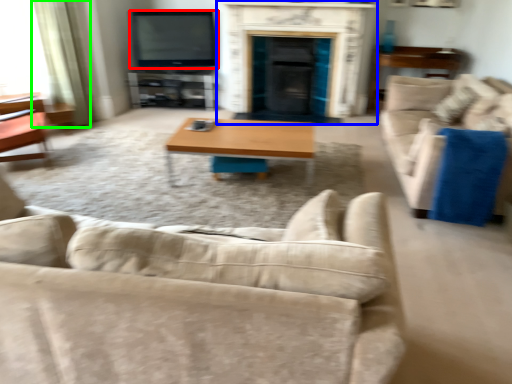
Question: Which object is the closest to the television (highlighted by a red box)? Choose among these: fireplace (highlighted by a blue box) or curtain (highlighted by a green box).

Choices:
 (A) fireplace
 (B) curtain

Answer: (A)